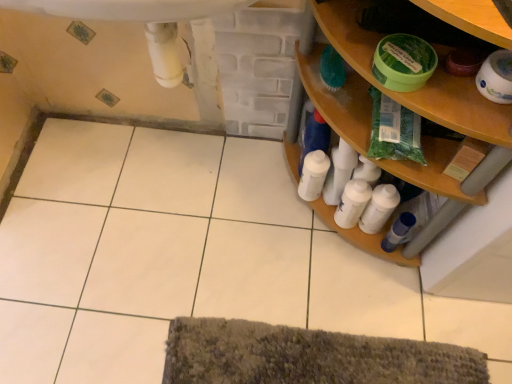
Locate an element on the screen. The image size is (512, 384). unoccupied space behind white glossy bottle at lower right, the 3th toiletry viewed from the right is located at coordinates (278, 158).